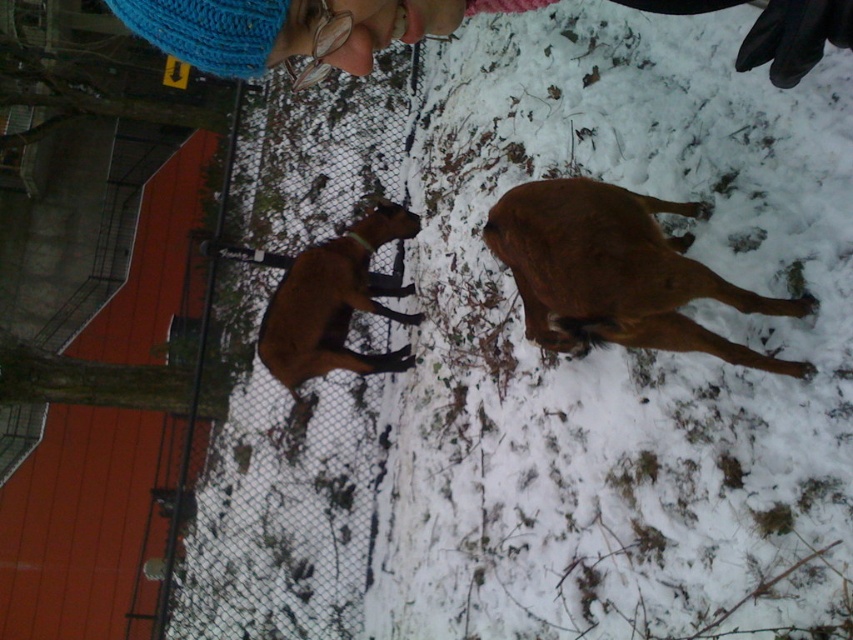
Looking at this image, between metal mesh fence at lower left and brown furry dog at center, which one has more height?

brown furry dog at center

Which is behind, point (305, 476) or point (654, 269)?

The point (305, 476) is behind.

Is point (268, 134) behind point (639, 268)?

Yes, point (268, 134) is behind point (639, 268).

What are the coordinates of `metal mesh fence at lower left` in the screenshot? It's located at (283, 387).

Can you confirm if metal mesh fence at lower left is bigger than blue knitted hat at upper center?

No, metal mesh fence at lower left is not bigger than blue knitted hat at upper center.

Is point (357, 461) more distant than point (131, 19)?

Yes, point (357, 461) is farther from viewer.

Find the location of `metal mesh fence at lower left`. metal mesh fence at lower left is located at coordinates (283, 387).

Between point (538, 241) and point (512, 3), which one is positioned in front?

Point (512, 3) is more forward.

Looking at this image, measure the distance from brown furry dog at center to blue knitted hat at upper center.

A distance of 1.08 meters exists between brown furry dog at center and blue knitted hat at upper center.

Who is more forward, (610, 337) or (213, 40)?

Positioned in front is point (213, 40).

Where is `brown furry dog at center`? Image resolution: width=853 pixels, height=640 pixels. brown furry dog at center is located at coordinates (616, 273).